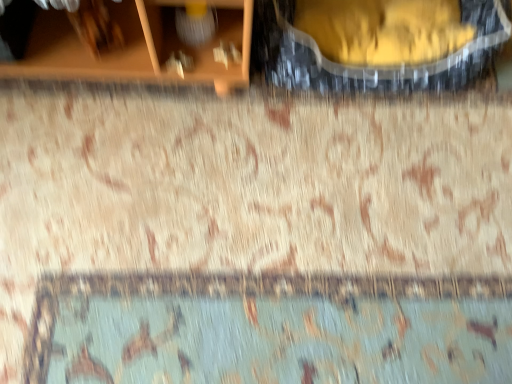
Question: Should I look upward or downward to see wooden shelf at upper left?

Choices:
 (A) down
 (B) up

Answer: (B)